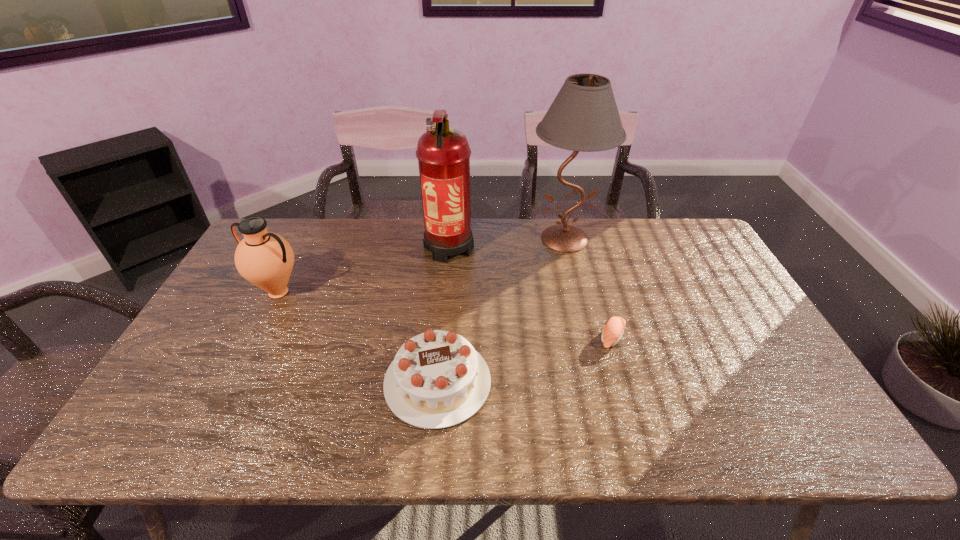
At what (x,y) coordinates should I click in order to perform the action: click on vacant space situated on the back of the sushi. Please return your answer as a coordinate pair (x, y). The width and height of the screenshot is (960, 540). Looking at the image, I should click on 594,276.

At what (x,y) coordinates should I click in order to perform the action: click on table lamp present at the far edge. Please return your answer as a coordinate pair (x, y). The image size is (960, 540). Looking at the image, I should click on (584, 117).

The width and height of the screenshot is (960, 540). I want to click on fire extinguisher located at the far edge, so click(443, 153).

The width and height of the screenshot is (960, 540). Find the location of `object that is positioned at the near edge`. object that is positioned at the near edge is located at coordinates (437, 379).

You are a GUI agent. You are given a task and a screenshot of the screen. Output one action in this format:
    pyautogui.click(x=<x>, y=<y>)
    Task: Click on the object located at the left edge
    
    Given the screenshot: What is the action you would take?
    pyautogui.click(x=265, y=259)

In order to click on vacant space at the far edge of the desktop in this screenshot , I will do `click(320, 227)`.

You are a GUI agent. You are given a task and a screenshot of the screen. Output one action in this format:
    pyautogui.click(x=<x>, y=<y>)
    Task: Click on the free point at the near edge
    The image size is (960, 540).
    Given the screenshot: What is the action you would take?
    pyautogui.click(x=228, y=435)

I want to click on vacant space at the left edge, so click(x=220, y=302).

Where is `vacant space at the right edge`? vacant space at the right edge is located at coordinates (763, 335).

At what (x,y) coordinates should I click in order to perform the action: click on vacant space at the far left corner of the desktop. Please return your answer as a coordinate pair (x, y). This screenshot has width=960, height=540. Looking at the image, I should click on (292, 235).